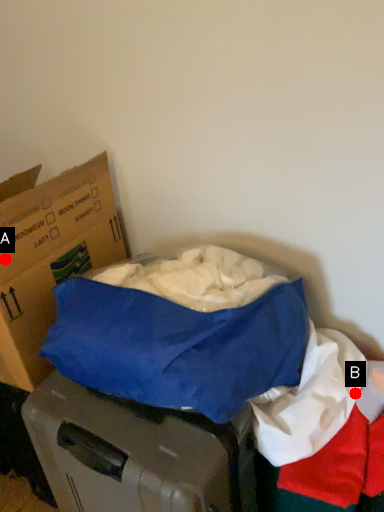
Question: Two points are circled on the image, labeled by A and B beside each circle. Which point is farther to the camera?

Choices:
 (A) A is further
 (B) B is further

Answer: (B)